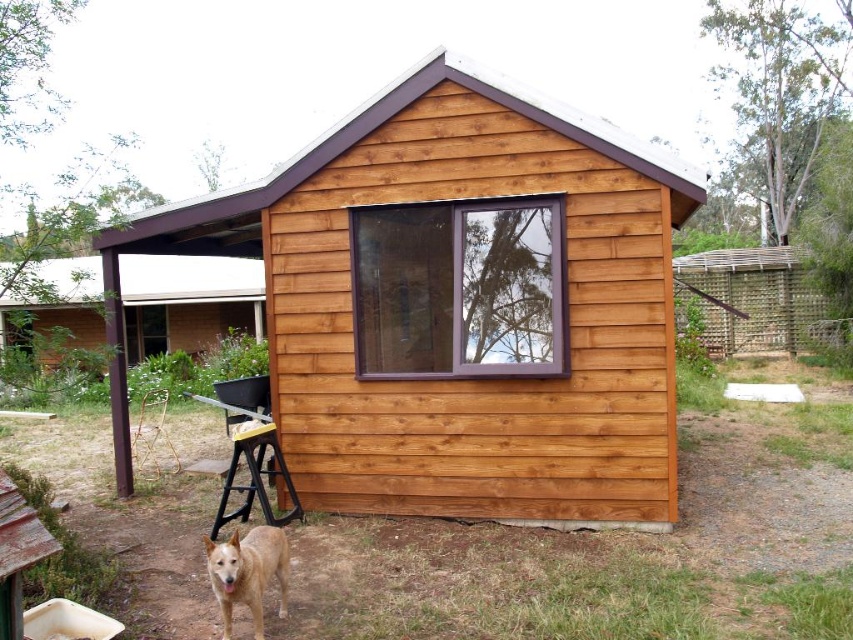
From the picture: You are a photographer setting up equipment in the scene. You have a camera that can only focus on objects taller than 30 cm. The golden fur dog at lower left and the yellow plastic stool at lower center are in your shot. Based on their sizes, which object will the camera focus on?

The yellow plastic stool at lower center is taller than the golden fur dog at lower left, so the camera will focus on the yellow plastic stool at lower center since it meets the height requirement of being taller than 30 cm.

You are planning to build a new cabin and want to ensure it will fit in the available space. You have a blueprint for a cabin that requires a minimum area of 20 square meters. Based on the image, can you determine if the natural wood cabin at center will fit within the space occupied by the brown wooden cabin at left?

The natural wood cabin at center is bigger than the brown wooden cabin at left. Since the new cabin requires 20 square meters, and the brown wooden cabin at left is smaller, it might not provide enough space. Therefore, the natural wood cabin at center may not fit within the space of the brown wooden cabin at left.